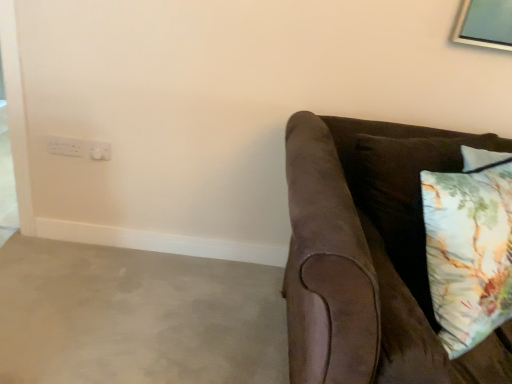
What do you see at coordinates (65, 146) in the screenshot?
I see `white plastic electrical outlet at upper left, the second electric outlet viewed from the right` at bounding box center [65, 146].

Measure the distance between white plastic electric outlet at upper left, the first electric outlet viewed from the right, and camera.

white plastic electric outlet at upper left, the first electric outlet viewed from the right, is 1.86 meters away from camera.

You are a GUI agent. You are given a task and a screenshot of the screen. Output one action in this format:
    pyautogui.click(x=<x>, y=<y>)
    Task: Click on the white plastic electrical outlet at upper left, the second electric outlet viewed from the right
    This screenshot has width=512, height=384.
    Given the screenshot: What is the action you would take?
    pyautogui.click(x=65, y=146)

Is suede brown couch at right taller or shorter than white plastic electrical outlet at upper left, the second electric outlet viewed from the right?

Clearly, suede brown couch at right is taller compared to white plastic electrical outlet at upper left, the second electric outlet viewed from the right.

From the image's perspective, between suede brown couch at right and white plastic electrical outlet at upper left, the second electric outlet viewed from the right, who is located below?

suede brown couch at right is shown below in the image.

Which of these two, suede brown couch at right or white plastic electrical outlet at upper left, the second electric outlet viewed from the right, is thinner?

white plastic electrical outlet at upper left, the second electric outlet viewed from the right, is thinner.

Is floral cotton pillow at right positioned before white plastic electrical outlet at upper left, the second electric outlet viewed from the right?

Yes, it is in front of white plastic electrical outlet at upper left, the second electric outlet viewed from the right.

From a real-world perspective, which object rests below the other?

white plastic electrical outlet at upper left, the second electric outlet viewed from the right, from a real-world perspective.

Between floral cotton pillow at right and white plastic electrical outlet at upper left, the 1th electric outlet in the left-to-right sequence, which one has larger width?

Wider between the two is floral cotton pillow at right.

Is floral cotton pillow at right turned away from white plastic electrical outlet at upper left, the 1th electric outlet in the left-to-right sequence?

Yes, floral cotton pillow at right is facing away from white plastic electrical outlet at upper left, the 1th electric outlet in the left-to-right sequence.

Is gray concrete at lower left at the left side of suede brown couch at right?

Yes, gray concrete at lower left is to the left of suede brown couch at right.

Is gray concrete at lower left positioned beyond the bounds of suede brown couch at right?

Yes, gray concrete at lower left is not within suede brown couch at right.

From the image's perspective, who appears lower, gray concrete at lower left or suede brown couch at right?

gray concrete at lower left, from the image's perspective.

Considering the relative sizes of gray concrete at lower left and suede brown couch at right in the image provided, is gray concrete at lower left taller than suede brown couch at right?

No, gray concrete at lower left is not taller than suede brown couch at right.

Can you confirm if suede brown couch at right is thinner than gray concrete at lower left?

Correct, the width of suede brown couch at right is less than that of gray concrete at lower left.

Would you say suede brown couch at right is a long distance from gray concrete at lower left?

No, suede brown couch at right is not far away from gray concrete at lower left.

In terms of size, does suede brown couch at right appear bigger or smaller than gray concrete at lower left?

Clearly, suede brown couch at right is larger in size than gray concrete at lower left.

Considering the points (342, 229) and (286, 347), which point is behind, point (342, 229) or point (286, 347)?

The point (286, 347) is farther.

Is point (474, 157) closer to camera compared to point (160, 272)?

Yes.

Is floral cotton pillow at right completely or partially outside of gray concrete at lower left?

Yes.

Which of these two, floral cotton pillow at right or gray concrete at lower left, is smaller?

gray concrete at lower left is smaller.

Which of these two, floral cotton pillow at right or gray concrete at lower left, is thinner?

floral cotton pillow at right.

Would you consider white plastic electric outlet at upper left, the first electric outlet viewed from the right, to be distant from gray concrete at lower left?

No.

Is white plastic electric outlet at upper left, positioned as the second electric outlet in left-to-right order, thinner than gray concrete at lower left?

Yes.

Where is `the 1st electric outlet to the left of the gray concrete at lower left, starting your count from the anchor`? This screenshot has width=512, height=384. the 1st electric outlet to the left of the gray concrete at lower left, starting your count from the anchor is located at coordinates (99, 150).

Could you measure the distance between white plastic electric outlet at upper left, the first electric outlet viewed from the right, and gray concrete at lower left?

white plastic electric outlet at upper left, the first electric outlet viewed from the right, is 74.14 centimeters from gray concrete at lower left.

At what (x,y) coordinates should I click in order to perform the action: click on pillow above the gray concrete at lower left (from the image's perspective). Please return your answer as a coordinate pair (x, y). The width and height of the screenshot is (512, 384). Looking at the image, I should click on (469, 247).

In the scene shown: From a real-world perspective, who is located higher, gray concrete at lower left or floral cotton pillow at right?

floral cotton pillow at right.

From the image's perspective, would you say gray concrete at lower left is shown under floral cotton pillow at right?

Yes, from the image's perspective, gray concrete at lower left is beneath floral cotton pillow at right.

Is gray concrete at lower left oriented away from floral cotton pillow at right?

gray concrete at lower left is not turned away from floral cotton pillow at right.

What are the coordinates of `studio couch lying in front of the white plastic electrical outlet at upper left, the 1th electric outlet in the left-to-right sequence` in the screenshot? It's located at (360, 272).

The height and width of the screenshot is (384, 512). In the image, there is a white plastic electrical outlet at upper left, the 1th electric outlet in the left-to-right sequence. What are the coordinates of `pillow below it (from the image's perspective)` in the screenshot? It's located at (469, 247).

Looking at the image, which one is located closer to white plastic electrical outlet at upper left, the 1th electric outlet in the left-to-right sequence, white plastic electric outlet at upper left, positioned as the second electric outlet in left-to-right order, or suede brown couch at right?

Among the two, white plastic electric outlet at upper left, positioned as the second electric outlet in left-to-right order, is located nearer to white plastic electrical outlet at upper left, the 1th electric outlet in the left-to-right sequence.

Looking at the image, which one is located closer to gray concrete at lower left, floral cotton pillow at right or suede brown couch at right?

suede brown couch at right is closer to gray concrete at lower left.

Based on the photo, estimate the real-world distances between objects in this image. Which object is further from white plastic electrical outlet at upper left, the second electric outlet viewed from the right, floral cotton pillow at right or gray concrete at lower left?

Among the two, floral cotton pillow at right is located further to white plastic electrical outlet at upper left, the second electric outlet viewed from the right.

Considering their positions, is white plastic electrical outlet at upper left, the second electric outlet viewed from the right, positioned closer to floral cotton pillow at right than suede brown couch at right?

suede brown couch at right is closer to floral cotton pillow at right.

Based on their spatial positions, is gray concrete at lower left or white plastic electrical outlet at upper left, the second electric outlet viewed from the right, further from white plastic electric outlet at upper left, the first electric outlet viewed from the right?

gray concrete at lower left.

When comparing their distances from white plastic electrical outlet at upper left, the 1th electric outlet in the left-to-right sequence, does white plastic electric outlet at upper left, the first electric outlet viewed from the right, or floral cotton pillow at right seem closer?

Based on the image, white plastic electric outlet at upper left, the first electric outlet viewed from the right, appears to be nearer to white plastic electrical outlet at upper left, the 1th electric outlet in the left-to-right sequence.

From the picture: Estimate the real-world distances between objects in this image. Which object is closer to floral cotton pillow at right, gray concrete at lower left or suede brown couch at right?

Based on the image, suede brown couch at right appears to be nearer to floral cotton pillow at right.

When comparing their distances from gray concrete at lower left, does floral cotton pillow at right or white plastic electric outlet at upper left, positioned as the second electric outlet in left-to-right order, seem closer?

white plastic electric outlet at upper left, positioned as the second electric outlet in left-to-right order, is positioned closer to the anchor gray concrete at lower left.

Identify the location of concrete situated between white plastic electrical outlet at upper left, the second electric outlet viewed from the right, and floral cotton pillow at right from left to right. Image resolution: width=512 pixels, height=384 pixels. (136, 317).

Where is `studio couch between white plastic electrical outlet at upper left, the 1th electric outlet in the left-to-right sequence, and floral cotton pillow at right from left to right`? The width and height of the screenshot is (512, 384). studio couch between white plastic electrical outlet at upper left, the 1th electric outlet in the left-to-right sequence, and floral cotton pillow at right from left to right is located at coordinates (360, 272).

Find the location of a particular element. studio couch between white plastic electric outlet at upper left, the first electric outlet viewed from the right, and floral cotton pillow at right is located at coordinates (360, 272).

Find the location of a particular element. electric outlet located between white plastic electrical outlet at upper left, the second electric outlet viewed from the right, and floral cotton pillow at right in the left-right direction is located at coordinates (99, 150).